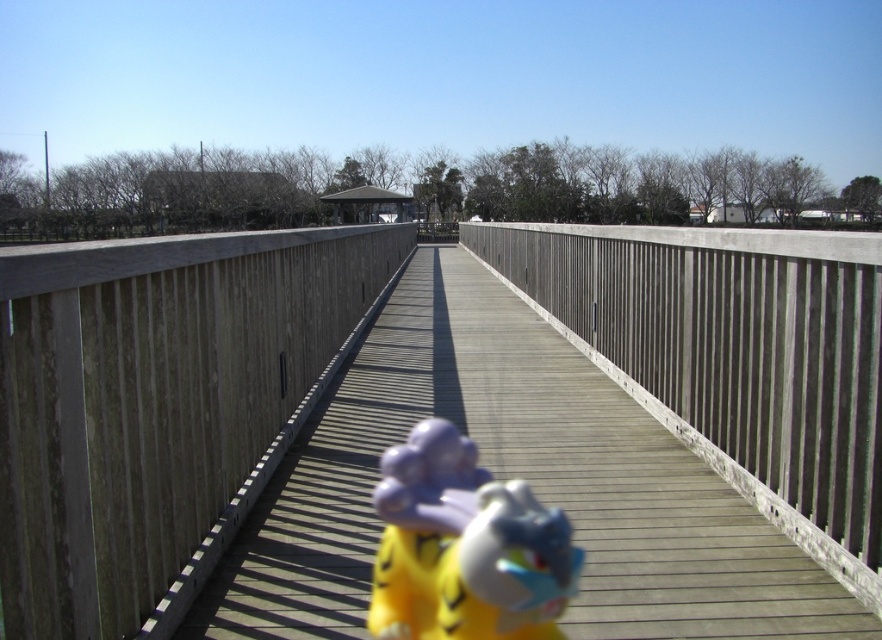
Is wooden bridge at center closer to the viewer compared to yellow plush toy at center?

Yes, it is.

Which of these two, wooden bridge at center or yellow plush toy at center, stands shorter?

yellow plush toy at center

Where is `wooden bridge at center`? wooden bridge at center is located at coordinates (152, 401).